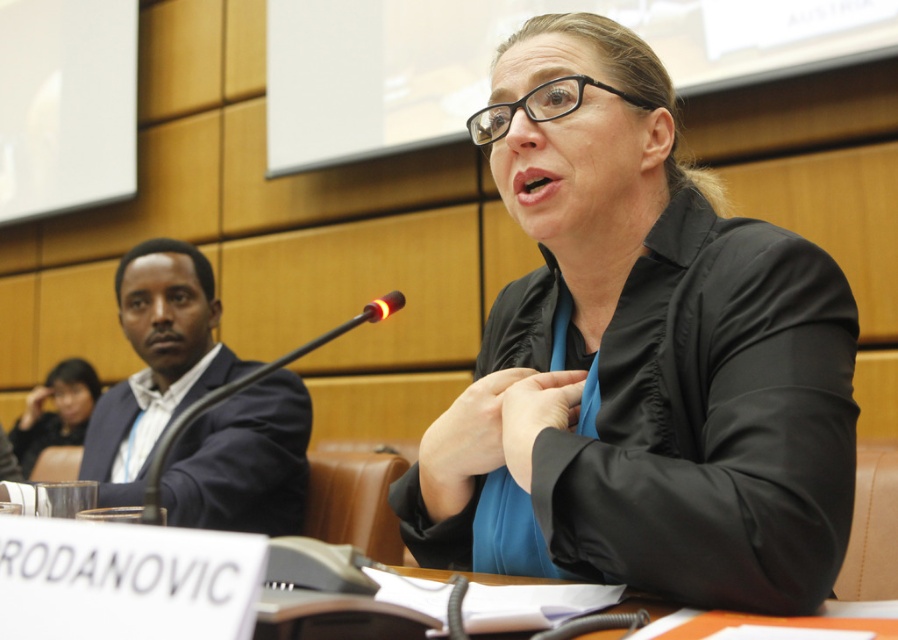
What are the coordinates of `orange paper at lower center` in the screenshot? It's located at (125, 580).

Is point (80, 579) farther from camera compared to point (58, 426)?

No, (80, 579) is in front of (58, 426).

Which is in front, point (4, 632) or point (21, 452)?

Point (4, 632) is in front.

You are a GUI agent. You are given a task and a screenshot of the screen. Output one action in this format:
    pyautogui.click(x=<x>, y=<y>)
    Task: Click on the orange paper at lower center
    The height and width of the screenshot is (640, 898).
    Given the screenshot: What is the action you would take?
    pyautogui.click(x=125, y=580)

I want to click on black matte blazer at center, so click(x=641, y=364).

Which is behind, point (753, 224) or point (152, 518)?

Point (753, 224)

Which is in front, point (590, 44) or point (147, 481)?

Point (147, 481)

You are a GUI agent. You are given a task and a screenshot of the screen. Output one action in this format:
    pyautogui.click(x=<x>, y=<y>)
    Task: Click on the black matte blazer at center
    The height and width of the screenshot is (640, 898).
    Given the screenshot: What is the action you would take?
    pyautogui.click(x=641, y=364)

Describe the element at coordinates (641, 364) in the screenshot. The image size is (898, 640). I see `black matte blazer at center` at that location.

Looking at this image, does black matte blazer at center have a larger size compared to orange paper at lower center?

Yes, black matte blazer at center is bigger than orange paper at lower center.

What do you see at coordinates (641, 364) in the screenshot? The height and width of the screenshot is (640, 898). I see `black matte blazer at center` at bounding box center [641, 364].

At what (x,y) coordinates should I click in order to perform the action: click on black matte blazer at center. Please return your answer as a coordinate pair (x, y). Looking at the image, I should click on (641, 364).